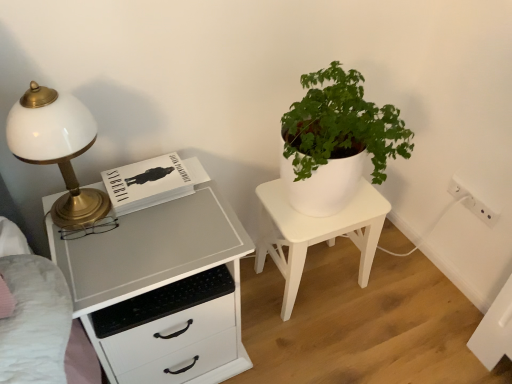
At what (x,y) coordinates should I click in order to perform the action: click on free spot to the right of white glossy chest of drawers at left. Please return your answer as a coordinate pair (x, y). The width and height of the screenshot is (512, 384). Looking at the image, I should click on (294, 336).